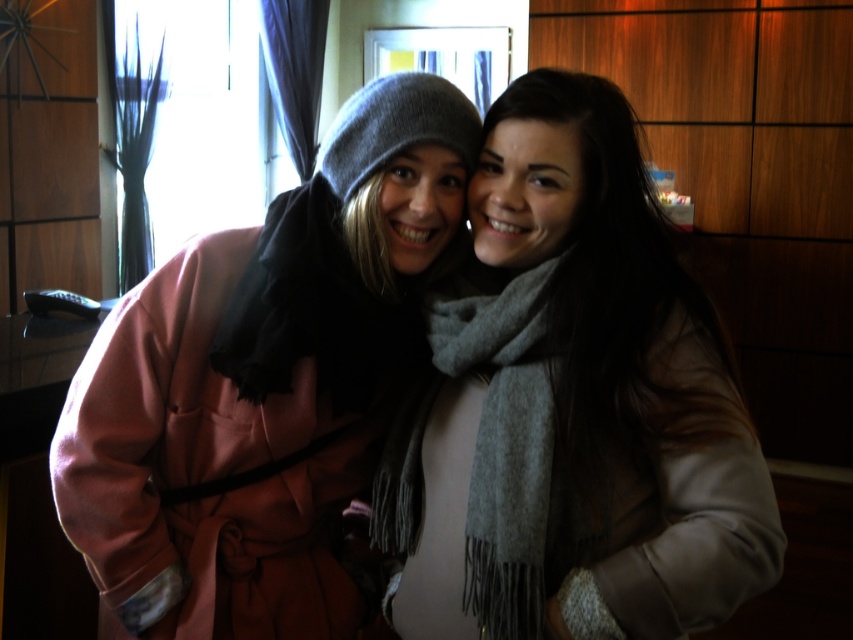
Question: Is gray wool scarf at center smaller than gray woolen scarf at center?

Choices:
 (A) no
 (B) yes

Answer: (A)

Question: Which point appears farthest from the camera in this image?

Choices:
 (A) (419, 413)
 (B) (334, 225)
 (C) (434, 307)

Answer: (A)

Question: From the image, what is the correct spatial relationship of matte pink coat at left in relation to gray woolen scarf at center?

Choices:
 (A) left
 (B) right

Answer: (A)

Question: Which object is farther from the camera taking this photo?

Choices:
 (A) matte pink coat at left
 (B) gray wool scarf at center

Answer: (A)

Question: Can you confirm if gray wool scarf at center is thinner than gray woolen scarf at center?

Choices:
 (A) yes
 (B) no

Answer: (B)

Question: Which object is the closest to the matte pink coat at left?

Choices:
 (A) gray wool scarf at center
 (B) gray woolen scarf at center

Answer: (A)